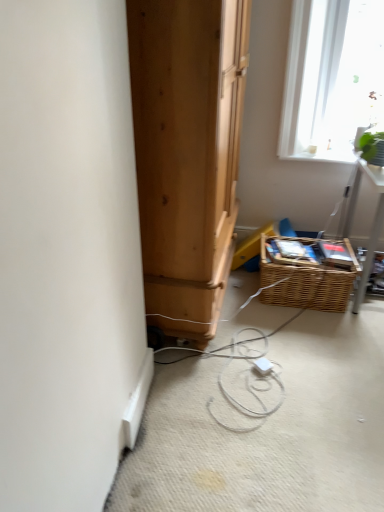
In order to face white plastic extension cord at center, should I rotate leftwards or rightwards?

Turn right approximately 9.406 degrees to face it.

Locate an element on the screen. This screenshot has height=512, width=384. woven brown basket at lower right is located at coordinates (307, 283).

Describe the element at coordinates (372, 147) in the screenshot. I see `green leafy plant at upper right` at that location.

Identify the location of green leafy plant at upper right. (372, 147).

The image size is (384, 512). I want to click on white plastic extension cord at center, so click(x=263, y=366).

What are the coordinates of `basket on the left of green leafy plant at upper right` in the screenshot? It's located at (307, 283).

Which object is further away from the camera, green leafy plant at upper right or woven brown basket at lower right?

woven brown basket at lower right is further from the camera.

Is green leafy plant at upper right not close to woven brown basket at lower right?

No.

Which point is more distant from viewer, [366,141] or [310,266]?

The point [310,266] is farther from the camera.

Is woven brown basket at lower right inside the boundaries of green leafy plant at upper right, or outside?

The correct answer is: outside.

Are woven brown basket at lower right and green leafy plant at upper right far apart?

woven brown basket at lower right is actually quite close to green leafy plant at upper right.

Is point (307, 286) positioned in front of point (367, 147)?

No, it is not.

What's the angular difference between woven brown basket at lower right and green leafy plant at upper right's facing directions?

The facing directions of woven brown basket at lower right and green leafy plant at upper right are 1.15 degrees apart.

Which is behind, green leafy plant at upper right or white plastic extension cord at center?

green leafy plant at upper right is behind.

Considering the relative sizes of green leafy plant at upper right and white plastic extension cord at center in the image provided, is green leafy plant at upper right wider than white plastic extension cord at center?

Yes, green leafy plant at upper right is wider than white plastic extension cord at center.

Which is nearer, (x=376, y=138) or (x=268, y=367)?

The point (x=268, y=367) is in front.

Can you confirm if green leafy plant at upper right is bigger than white plastic extension cord at center?

Correct, green leafy plant at upper right is larger in size than white plastic extension cord at center.

Which of these two, white plastic extension cord at center or green leafy plant at upper right, stands shorter?

With less height is white plastic extension cord at center.

Is point (258, 365) less distant than point (374, 138)?

Yes.

Relative to green leafy plant at upper right, is white plastic extension cord at center in front or behind?

white plastic extension cord at center is in front of green leafy plant at upper right.

In the scene shown: Which object is wider, white plastic extension cord at center or green leafy plant at upper right?

green leafy plant at upper right.

Which object is closer to the camera taking this photo, woven brown basket at lower right or white plastic extension cord at center?

white plastic extension cord at center is closer to the camera.

Can you confirm if woven brown basket at lower right is wider than white plastic extension cord at center?

Indeed, woven brown basket at lower right has a greater width compared to white plastic extension cord at center.

From a real-world perspective, is woven brown basket at lower right beneath white plastic extension cord at center?

No.

Which of these two, woven brown basket at lower right or white plastic extension cord at center, is smaller?

Smaller between the two is white plastic extension cord at center.

Which is more to the right, white plastic extension cord at center or woven brown basket at lower right?

Positioned to the right is woven brown basket at lower right.

Is white plastic extension cord at center wider than woven brown basket at lower right?

Incorrect, the width of white plastic extension cord at center does not surpass that of woven brown basket at lower right.

Does point (259, 373) lie in front of point (304, 297)?

Yes, it is.

Identify the location of plant above the woven brown basket at lower right (from a real-world perspective). The height and width of the screenshot is (512, 384). (372, 147).

This screenshot has height=512, width=384. In the image, there is a woven brown basket at lower right. In order to click on plant above it (from the image's perspective) in this screenshot , I will do `click(372, 147)`.

From the image, which object appears to be farther from white plastic extension cord at center, green leafy plant at upper right or woven brown basket at lower right?

green leafy plant at upper right lies further to white plastic extension cord at center than the other object.

Based on their spatial positions, is woven brown basket at lower right or green leafy plant at upper right further from white plastic extension cord at center?

The object further to white plastic extension cord at center is green leafy plant at upper right.

From the image, which object appears to be farther from green leafy plant at upper right, woven brown basket at lower right or white plastic extension cord at center?

white plastic extension cord at center is positioned further to the anchor green leafy plant at upper right.

Based on their spatial positions, is white plastic extension cord at center or woven brown basket at lower right further from green leafy plant at upper right?

Based on the image, white plastic extension cord at center appears to be further to green leafy plant at upper right.

Estimate the real-world distances between objects in this image. Which object is further from woven brown basket at lower right, white plastic extension cord at center or green leafy plant at upper right?

Based on the image, green leafy plant at upper right appears to be further to woven brown basket at lower right.

Looking at the image, which one is located further to woven brown basket at lower right, green leafy plant at upper right or white plastic extension cord at center?

green leafy plant at upper right.

This screenshot has width=384, height=512. I want to click on basket that lies between green leafy plant at upper right and white plastic extension cord at center from top to bottom, so click(x=307, y=283).